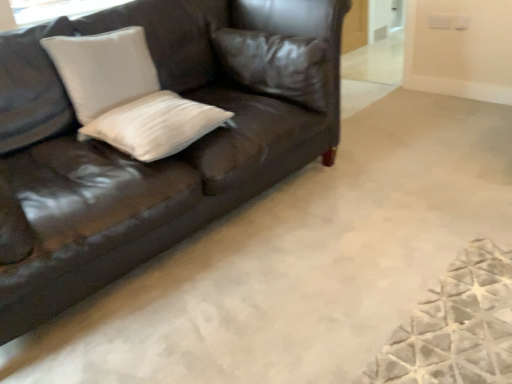
This screenshot has height=384, width=512. What do you see at coordinates (275, 64) in the screenshot?
I see `leather pillow at upper center, which is the first pillow from right to left` at bounding box center [275, 64].

Where is `leather pillow at upper center, which is the third pillow in left-to-right order`? The width and height of the screenshot is (512, 384). leather pillow at upper center, which is the third pillow in left-to-right order is located at coordinates (275, 64).

What do you see at coordinates (173, 155) in the screenshot? I see `shiny brown leather couch at upper left` at bounding box center [173, 155].

Measure the distance between white matte pillow at upper left, which appears as the 3th pillow when viewed from the right, and camera.

white matte pillow at upper left, which appears as the 3th pillow when viewed from the right, and camera are 1.64 meters apart.

At what (x,y) coordinates should I click in order to perform the action: click on leather pillow at upper center, which is the first pillow from right to left. Please return your answer as a coordinate pair (x, y). The image size is (512, 384). Looking at the image, I should click on click(x=275, y=64).

How different are the orientations of shiny brown leather couch at upper left and white matte pillow at upper left, which is counted as the 1th pillow, starting from the left, in degrees?

There is a 0.000248-degree angle between the facing directions of shiny brown leather couch at upper left and white matte pillow at upper left, which is counted as the 1th pillow, starting from the left.

Between shiny brown leather couch at upper left and white matte pillow at upper left, which is counted as the 1th pillow, starting from the left, which one has less height?

With less height is white matte pillow at upper left, which is counted as the 1th pillow, starting from the left.

From the image's perspective, does shiny brown leather couch at upper left appear lower than white matte pillow at upper left, which is counted as the 1th pillow, starting from the left?

Yes.

How distant is white matte pillow at center, arranged as the 2th pillow when viewed from the left, from leather pillow at upper center, which is the third pillow in left-to-right order?

They are 19.96 inches apart.

From the image's perspective, is white matte pillow at center, the second pillow positioned from the right, beneath leather pillow at upper center, which is the third pillow in left-to-right order?

Yes, from the image's perspective, white matte pillow at center, the second pillow positioned from the right, is below leather pillow at upper center, which is the third pillow in left-to-right order.

Considering the relative sizes of white matte pillow at center, the second pillow positioned from the right, and leather pillow at upper center, which is the third pillow in left-to-right order, in the image provided, is white matte pillow at center, the second pillow positioned from the right, taller than leather pillow at upper center, which is the third pillow in left-to-right order,?

Incorrect, the height of white matte pillow at center, the second pillow positioned from the right, is not larger of that of leather pillow at upper center, which is the third pillow in left-to-right order.

How different are the orientations of leather pillow at upper center, which is the first pillow from right to left, and shiny brown leather couch at upper left in degrees?

The angle between the facing direction of leather pillow at upper center, which is the first pillow from right to left, and the facing direction of shiny brown leather couch at upper left is 90 degrees.

The width and height of the screenshot is (512, 384). What are the coordinates of `studio couch lying in front of the leather pillow at upper center, which is the third pillow in left-to-right order` in the screenshot? It's located at (173, 155).

Is leather pillow at upper center, which is the third pillow in left-to-right order, wider than shiny brown leather couch at upper left?

A: No.

From a real-world perspective, is leather pillow at upper center, which is the third pillow in left-to-right order, over shiny brown leather couch at upper left?

Yes, from a real-world perspective, leather pillow at upper center, which is the third pillow in left-to-right order, is above shiny brown leather couch at upper left.

Which is less distant, (220, 126) or (106, 96)?

Point (220, 126).

Which is more to the right, white matte pillow at center, the second pillow positioned from the right, or white matte pillow at upper left, which appears as the 3th pillow when viewed from the right?

Positioned to the right is white matte pillow at center, the second pillow positioned from the right.

Is white matte pillow at center, the second pillow positioned from the right, oriented away from white matte pillow at upper left, which appears as the 3th pillow when viewed from the right?

Yes.

Is white matte pillow at center, arranged as the 2th pillow when viewed from the left, placed right next to white matte pillow at upper left, which is counted as the 1th pillow, starting from the left?

No.

From the picture: Which is more to the right, shiny brown leather couch at upper left or white matte pillow at center, arranged as the 2th pillow when viewed from the left?

white matte pillow at center, arranged as the 2th pillow when viewed from the left.

Is shiny brown leather couch at upper left placed right next to white matte pillow at center, the second pillow positioned from the right?

No, shiny brown leather couch at upper left is not next to white matte pillow at center, the second pillow positioned from the right.

The width and height of the screenshot is (512, 384). Find the location of `studio couch on the left of white matte pillow at center, the second pillow positioned from the right`. studio couch on the left of white matte pillow at center, the second pillow positioned from the right is located at coordinates (173, 155).

Which of these two, shiny brown leather couch at upper left or white matte pillow at center, the second pillow positioned from the right, is bigger?

Bigger between the two is shiny brown leather couch at upper left.

Which object is thinner, white matte pillow at upper left, which appears as the 3th pillow when viewed from the right, or leather pillow at upper center, which is the first pillow from right to left?

Thinner between the two is white matte pillow at upper left, which appears as the 3th pillow when viewed from the right.

The image size is (512, 384). What are the coordinates of `pillow above the leather pillow at upper center, which is the first pillow from right to left (from a real-world perspective)` in the screenshot? It's located at (103, 70).

From the image's perspective, between white matte pillow at upper left, which appears as the 3th pillow when viewed from the right, and leather pillow at upper center, which is the first pillow from right to left, which one is located above?

leather pillow at upper center, which is the first pillow from right to left, is shown above in the image.

From a real-world perspective, is white matte pillow at center, arranged as the 2th pillow when viewed from the left, physically below shiny brown leather couch at upper left?

No, from a real-world perspective, white matte pillow at center, arranged as the 2th pillow when viewed from the left, is not beneath shiny brown leather couch at upper left.

Can you confirm if white matte pillow at center, the second pillow positioned from the right, is thinner than shiny brown leather couch at upper left?

Indeed, white matte pillow at center, the second pillow positioned from the right, has a lesser width compared to shiny brown leather couch at upper left.

Is white matte pillow at center, the second pillow positioned from the right, spatially inside shiny brown leather couch at upper left, or outside of it?

white matte pillow at center, the second pillow positioned from the right, lies within the bounds of shiny brown leather couch at upper left.

Considering the relative positions of white matte pillow at center, arranged as the 2th pillow when viewed from the left, and shiny brown leather couch at upper left in the image provided, is white matte pillow at center, arranged as the 2th pillow when viewed from the left, to the right of shiny brown leather couch at upper left from the viewer's perspective?

Correct, you'll find white matte pillow at center, arranged as the 2th pillow when viewed from the left, to the right of shiny brown leather couch at upper left.

You are a GUI agent. You are given a task and a screenshot of the screen. Output one action in this format:
    pyautogui.click(x=<x>, y=<y>)
    Task: Click on the 2nd pillow behind the shiny brown leather couch at upper left
    This screenshot has height=384, width=512.
    Given the screenshot: What is the action you would take?
    pyautogui.click(x=103, y=70)

You are a GUI agent. You are given a task and a screenshot of the screen. Output one action in this format:
    pyautogui.click(x=<x>, y=<y>)
    Task: Click on the pillow below the leather pillow at upper center, which is the first pillow from right to left (from a real-world perspective)
    
    Given the screenshot: What is the action you would take?
    tap(155, 125)

Considering their positions, is white matte pillow at upper left, which is counted as the 1th pillow, starting from the left, positioned closer to white matte pillow at center, arranged as the 2th pillow when viewed from the left, than shiny brown leather couch at upper left?

white matte pillow at upper left, which is counted as the 1th pillow, starting from the left, lies closer to white matte pillow at center, arranged as the 2th pillow when viewed from the left, than the other object.

Based on their spatial positions, is white matte pillow at center, the second pillow positioned from the right, or leather pillow at upper center, which is the first pillow from right to left, closer to white matte pillow at upper left, which is counted as the 1th pillow, starting from the left?

The object closer to white matte pillow at upper left, which is counted as the 1th pillow, starting from the left, is white matte pillow at center, the second pillow positioned from the right.

Looking at this image, based on their spatial positions, is shiny brown leather couch at upper left or leather pillow at upper center, which is the third pillow in left-to-right order, further from white matte pillow at upper left, which is counted as the 1th pillow, starting from the left?

Among the two, leather pillow at upper center, which is the third pillow in left-to-right order, is located further to white matte pillow at upper left, which is counted as the 1th pillow, starting from the left.

Estimate the real-world distances between objects in this image. Which object is further from white matte pillow at upper left, which is counted as the 1th pillow, starting from the left, leather pillow at upper center, which is the third pillow in left-to-right order, or shiny brown leather couch at upper left?

Among the two, leather pillow at upper center, which is the third pillow in left-to-right order, is located further to white matte pillow at upper left, which is counted as the 1th pillow, starting from the left.

Estimate the real-world distances between objects in this image. Which object is further from white matte pillow at upper left, which appears as the 3th pillow when viewed from the right, shiny brown leather couch at upper left or white matte pillow at center, the second pillow positioned from the right?

Among the two, shiny brown leather couch at upper left is located further to white matte pillow at upper left, which appears as the 3th pillow when viewed from the right.

Looking at the image, which one is located closer to shiny brown leather couch at upper left, leather pillow at upper center, which is the third pillow in left-to-right order, or white matte pillow at upper left, which appears as the 3th pillow when viewed from the right?

leather pillow at upper center, which is the third pillow in left-to-right order.

When comparing their distances from white matte pillow at center, the second pillow positioned from the right, does shiny brown leather couch at upper left or white matte pillow at upper left, which is counted as the 1th pillow, starting from the left, seem further?

shiny brown leather couch at upper left lies further to white matte pillow at center, the second pillow positioned from the right, than the other object.

When comparing their distances from shiny brown leather couch at upper left, does white matte pillow at center, the second pillow positioned from the right, or white matte pillow at upper left, which is counted as the 1th pillow, starting from the left, seem closer?

Among the two, white matte pillow at center, the second pillow positioned from the right, is located nearer to shiny brown leather couch at upper left.

Locate an element on the screen. Image resolution: width=512 pixels, height=384 pixels. pillow between white matte pillow at upper left, which appears as the 3th pillow when viewed from the right, and leather pillow at upper center, which is the first pillow from right to left is located at coordinates (155, 125).

The height and width of the screenshot is (384, 512). Identify the location of pillow located between shiny brown leather couch at upper left and white matte pillow at upper left, which is counted as the 1th pillow, starting from the left, in the depth direction. (155, 125).